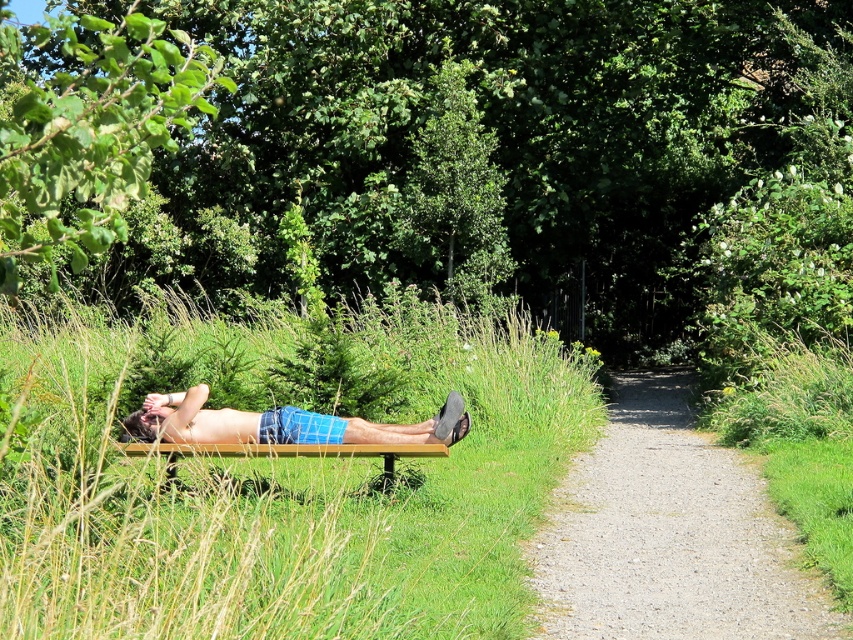
Question: Which of these objects is positioned farthest from the green leafy tree at center?

Choices:
 (A) green leafy tree at upper center
 (B) green grass at center
 (C) wooden bench at center
 (D) blue plaid shorts at center

Answer: (C)

Question: Is blue plaid shorts at center to the right of wooden bench at center from the viewer's perspective?

Choices:
 (A) no
 (B) yes

Answer: (B)

Question: Can you confirm if gravel path at center is positioned above wooden bench at center?

Choices:
 (A) yes
 (B) no

Answer: (B)

Question: Which of the following is the closest to the observer?

Choices:
 (A) green leafy tree at center
 (B) gravel path at center
 (C) blue plaid shorts at center

Answer: (B)

Question: Which point appears closest to the camera in this image?

Choices:
 (A) (444, 420)
 (B) (413, 260)
 (C) (840, 38)

Answer: (A)

Question: Can you confirm if green leafy tree at upper center is thinner than green grass at center?

Choices:
 (A) no
 (B) yes

Answer: (A)